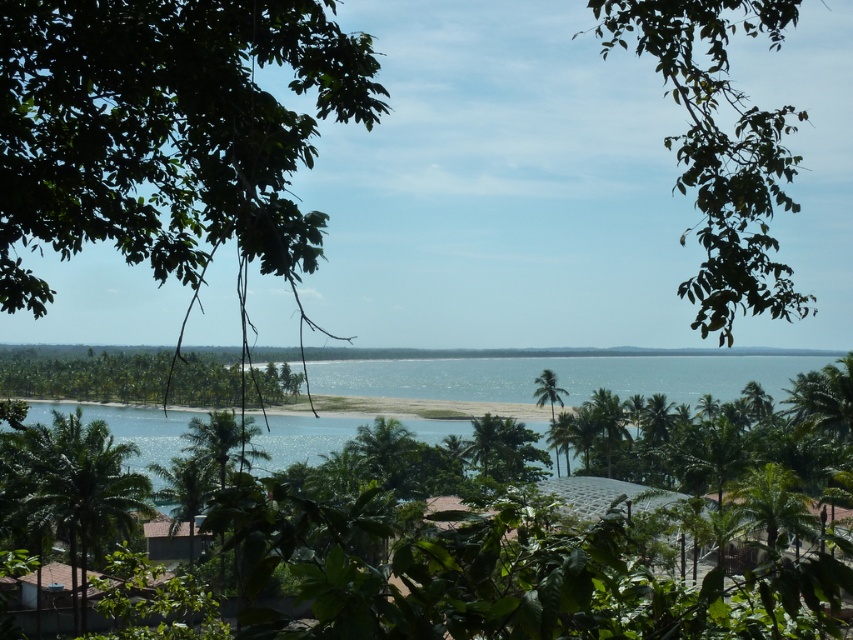
You are standing on the sandy beach and looking towards the dense foliage. Which object, the green leafy branch at upper right or the green leafy palm tree at lower left, would appear closer to you?

The green leafy palm tree at lower left is closer to you because it is positioned lower in the scene, while the green leafy branch at upper right is higher up, indicating it is further away.

You are standing on the beach and want to take a photo of both the green leafy palm tree at lower left and the green leafy tree at center. Which tree should you position closer to the camera to ensure both are fully visible in the frame?

The green leafy palm tree at lower left is taller than the green leafy tree at center. To ensure both are fully visible in the frame, position the camera closer to the green leafy palm tree at lower left so that the shorter tree remains in view while accommodating the height of the taller palm tree.